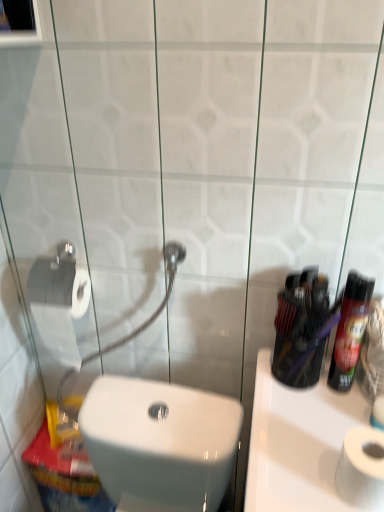
Question: From the image's perspective, is shiny black spray can at right located above or below white matte toilet paper at lower right?

Choices:
 (A) above
 (B) below

Answer: (A)

Question: From a real-world perspective, relative to white matte toilet paper at lower right, is shiny black spray can at right vertically above or below?

Choices:
 (A) below
 (B) above

Answer: (B)

Question: Based on their relative distances, which object is nearer to the shiny black spray can at right?

Choices:
 (A) translucent plastic mouthwash at center
 (B) white matte toilet paper at lower right
 (C) white glossy toilet at lower left
 (D) white glossy sink at right

Answer: (A)

Question: Estimate the real-world distances between objects in this image. Which object is farther from the translucent plastic mouthwash at center?

Choices:
 (A) white glossy sink at right
 (B) shiny black spray can at right
 (C) white matte toilet paper at lower right
 (D) white glossy toilet at lower left

Answer: (D)